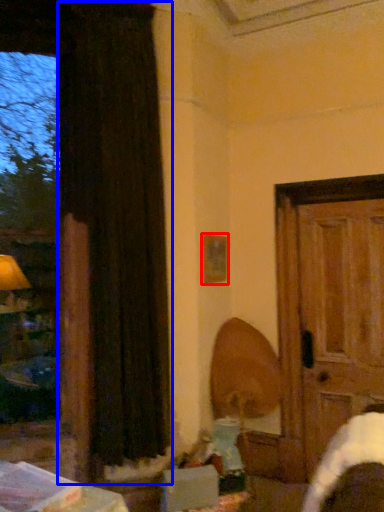
Question: Which object appears farthest to the camera in this image, picture frame (highlighted by a red box) or curtain (highlighted by a blue box)?

Choices:
 (A) picture frame
 (B) curtain

Answer: (A)